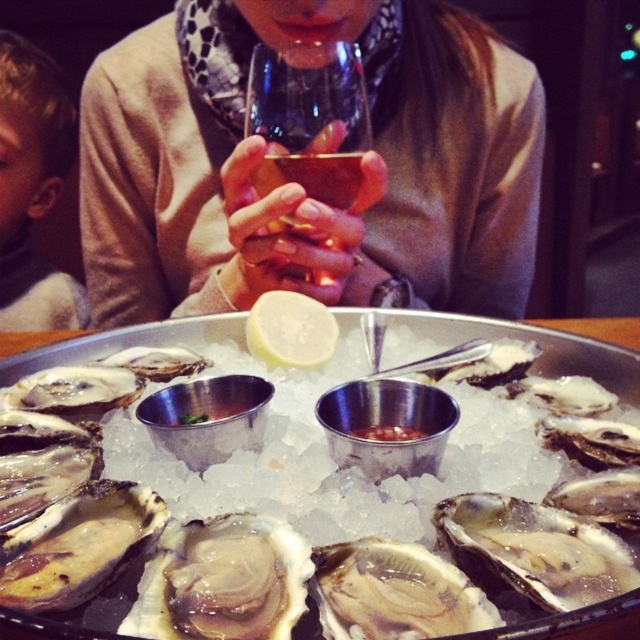
Can you confirm if transparent glass wine glass at center is positioned above shiny silver oyster at center?

Indeed, transparent glass wine glass at center is positioned over shiny silver oyster at center.

Does transparent glass wine glass at center have a lesser width compared to shiny silver oyster at center?

Correct, transparent glass wine glass at center's width is less than shiny silver oyster at center's.

Describe the element at coordinates (308, 120) in the screenshot. I see `transparent glass wine glass at center` at that location.

Identify the location of transparent glass wine glass at center. The width and height of the screenshot is (640, 640). (308, 120).

Which is in front, point (323, 67) or point (314, 308)?

Point (323, 67) is in front.

Is transparent glass wine glass at center below yellow matte lemon at center?

Actually, transparent glass wine glass at center is above yellow matte lemon at center.

Is point (275, 154) less distant than point (317, 346)?

No, it is behind (317, 346).

Where is `transparent glass wine glass at center`? This screenshot has height=640, width=640. transparent glass wine glass at center is located at coordinates (308, 120).

Can you confirm if shiny silver oyster at center is smaller than yellow matte lemon at center?

No.

Looking at this image, can you confirm if shiny silver oyster at center is thinner than yellow matte lemon at center?

In fact, shiny silver oyster at center might be wider than yellow matte lemon at center.

Image resolution: width=640 pixels, height=640 pixels. In order to click on shiny silver oyster at center in this screenshot , I will do point(579,625).